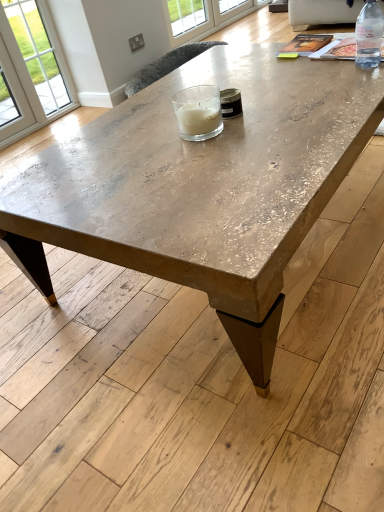
Image resolution: width=384 pixels, height=512 pixels. Identify the location of vacant region to the left of clear plastic bottle at upper right. (314, 76).